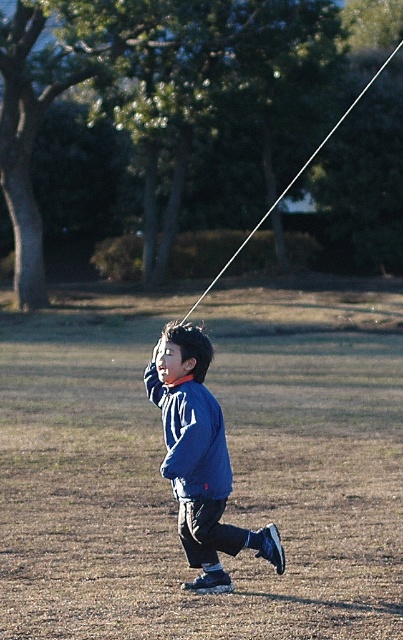
Between point (172, 456) and point (186, 314), which one is positioned in front?

Point (172, 456) is in front.

I want to click on blue matte jacket at center, so click(199, 458).

Where is `blue matte jacket at center`? The image size is (403, 640). blue matte jacket at center is located at coordinates (199, 458).

Between blue matte jacket at center and matte blue jacket at center, which one is positioned lower?

blue matte jacket at center is lower down.

Is point (222, 547) in front of point (176, 433)?

Yes, point (222, 547) is in front of point (176, 433).

What are the coordinates of `blue matte jacket at center` in the screenshot? It's located at (199, 458).

Does matte blue jacket at center have a smaller size compared to white string at upper center?

Correct, matte blue jacket at center occupies less space than white string at upper center.

Describe the element at coordinates (191, 436) in the screenshot. The image size is (403, 640). I see `matte blue jacket at center` at that location.

I want to click on matte blue jacket at center, so click(191, 436).